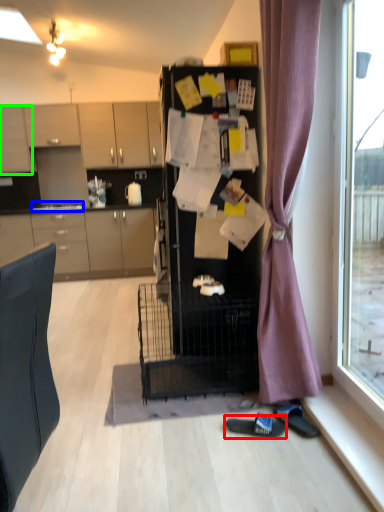
Question: Which is farther away from footwear (highlighted by a red box)? sink (highlighted by a blue box) or cabinetry (highlighted by a green box)?

Choices:
 (A) sink
 (B) cabinetry

Answer: (B)